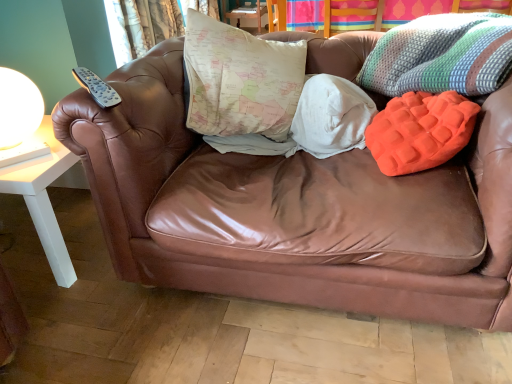
Question: Is textured fabric curtain at upper left not close to map-patterned fabric pillow at center, the second pillow when ordered from right to left?

Choices:
 (A) yes
 (B) no

Answer: (A)

Question: Can map-patterned fabric pillow at center, which ranks as the 1th pillow in left-to-right order, be found inside textured fabric curtain at upper left?

Choices:
 (A) yes
 (B) no

Answer: (B)

Question: Is textured fabric curtain at upper left at the left side of map-patterned fabric pillow at center, the second pillow when ordered from right to left?

Choices:
 (A) no
 (B) yes

Answer: (B)

Question: Considering the relative sizes of textured fabric curtain at upper left and map-patterned fabric pillow at center, which ranks as the 1th pillow in left-to-right order, in the image provided, is textured fabric curtain at upper left bigger than map-patterned fabric pillow at center, which ranks as the 1th pillow in left-to-right order,?

Choices:
 (A) yes
 (B) no

Answer: (B)

Question: Does textured fabric curtain at upper left lie behind map-patterned fabric pillow at center, which ranks as the 1th pillow in left-to-right order?

Choices:
 (A) no
 (B) yes

Answer: (B)

Question: Is knitted multicolored throw pillow at upper right wider or thinner than white glossy table lamp at left?

Choices:
 (A) wide
 (B) thin

Answer: (A)

Question: Based on their positions, is knitted multicolored throw pillow at upper right located to the left or right of white glossy table lamp at left?

Choices:
 (A) right
 (B) left

Answer: (A)

Question: Considering the positions of point (460, 21) and point (31, 89), is point (460, 21) closer or farther from the camera than point (31, 89)?

Choices:
 (A) closer
 (B) farther

Answer: (B)

Question: From a real-world perspective, is knitted multicolored throw pillow at upper right physically located above or below white glossy table lamp at left?

Choices:
 (A) below
 (B) above

Answer: (B)

Question: Is map-patterned fabric pillow at center, which ranks as the 1th pillow in left-to-right order, bigger or smaller than white glossy table lamp at left?

Choices:
 (A) big
 (B) small

Answer: (A)

Question: Is map-patterned fabric pillow at center, the second pillow when ordered from right to left, inside the boundaries of white glossy table lamp at left, or outside?

Choices:
 (A) inside
 (B) outside

Answer: (B)

Question: In terms of width, does map-patterned fabric pillow at center, which ranks as the 1th pillow in left-to-right order, look wider or thinner when compared to white glossy table lamp at left?

Choices:
 (A) wide
 (B) thin

Answer: (A)

Question: From the image's perspective, relative to white glossy table lamp at left, is map-patterned fabric pillow at center, the second pillow when ordered from right to left, above or below?

Choices:
 (A) above
 (B) below

Answer: (A)

Question: Is map-patterned fabric pillow at center, the second pillow when ordered from right to left, inside the boundaries of knitted multicolored throw pillow at upper right, or outside?

Choices:
 (A) inside
 (B) outside

Answer: (B)

Question: Visually, is map-patterned fabric pillow at center, the second pillow when ordered from right to left, positioned to the left or to the right of knitted multicolored throw pillow at upper right?

Choices:
 (A) right
 (B) left

Answer: (B)